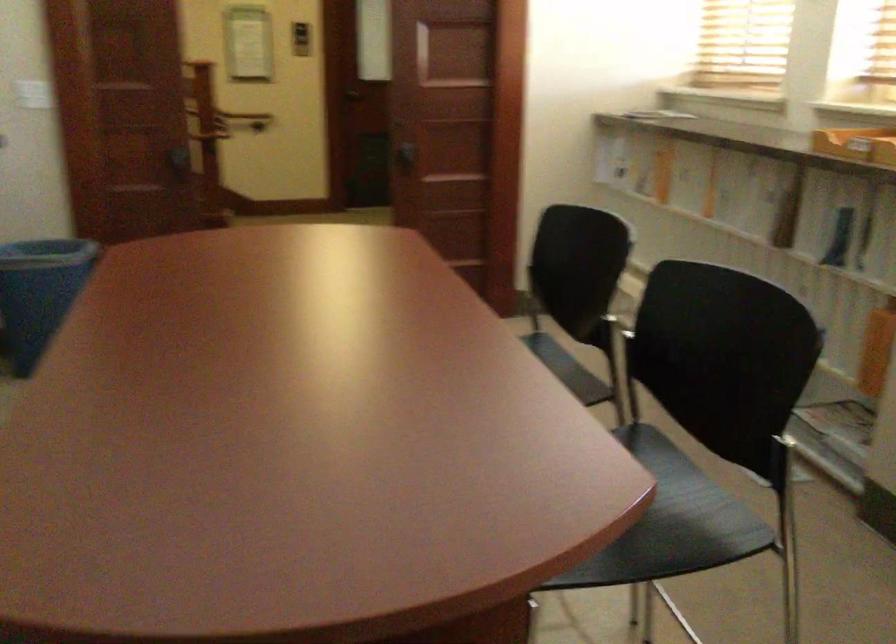
Locate an element on the screen. The width and height of the screenshot is (896, 644). wooden handrail is located at coordinates (243, 116).